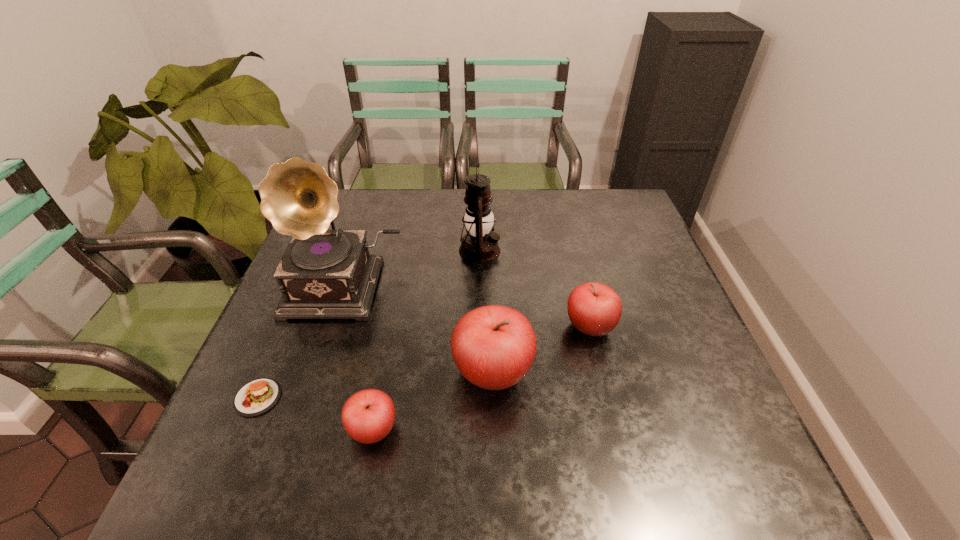
Where is `free spot that satisfies the following two spatial constraints: 1. on the horn of the tallest object; 2. on the left side of the tallest apple`? The height and width of the screenshot is (540, 960). free spot that satisfies the following two spatial constraints: 1. on the horn of the tallest object; 2. on the left side of the tallest apple is located at coordinates (316, 373).

The image size is (960, 540). I want to click on vacant position in the image that satisfies the following two spatial constraints: 1. on the back side of the leftmost apple; 2. on the right side of the tallest apple, so click(384, 373).